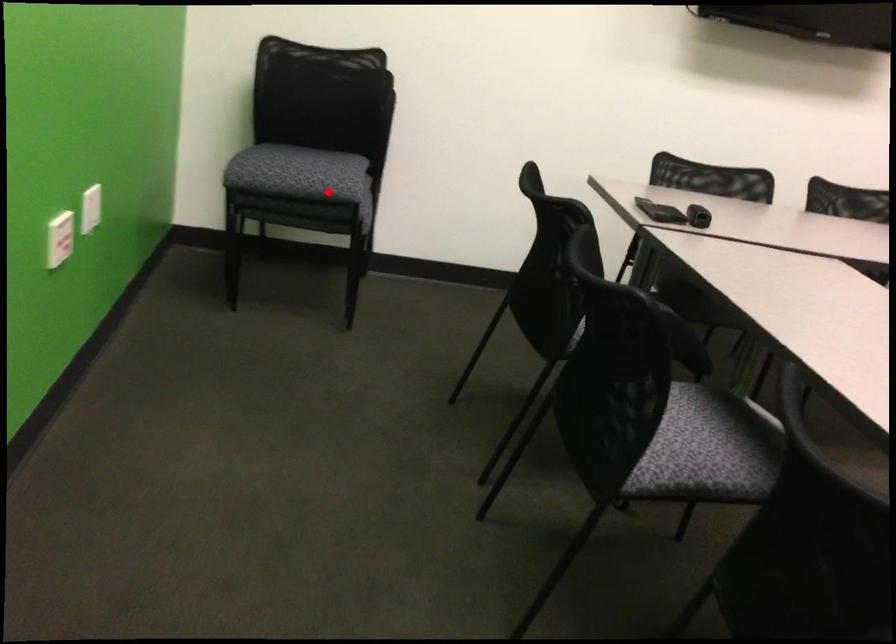
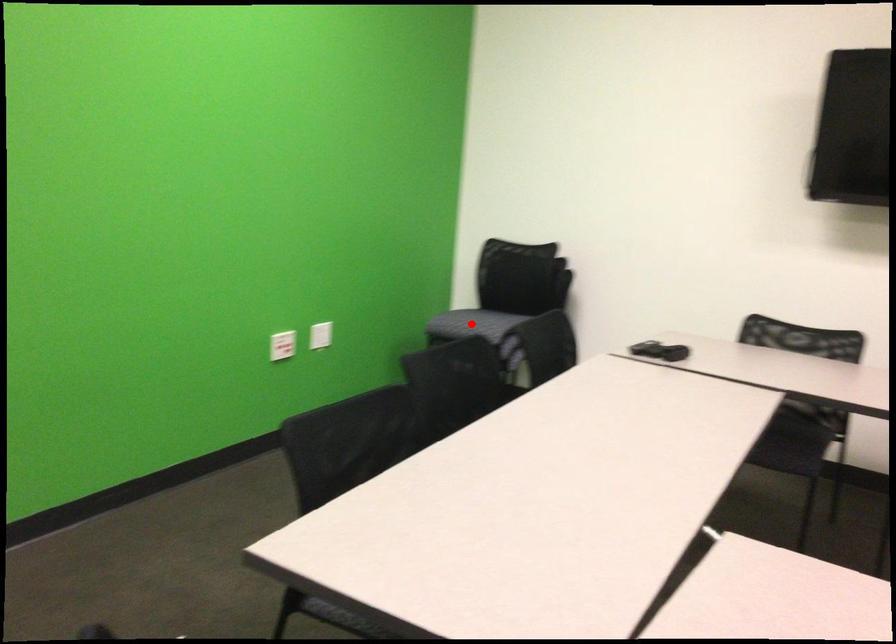
I am providing you with two images of the same scene from different viewpoints. A red point is marked on the first image and another point is marked on the second image. Does the point marked in image1 correspond to the same location as the one in image2?

Yes